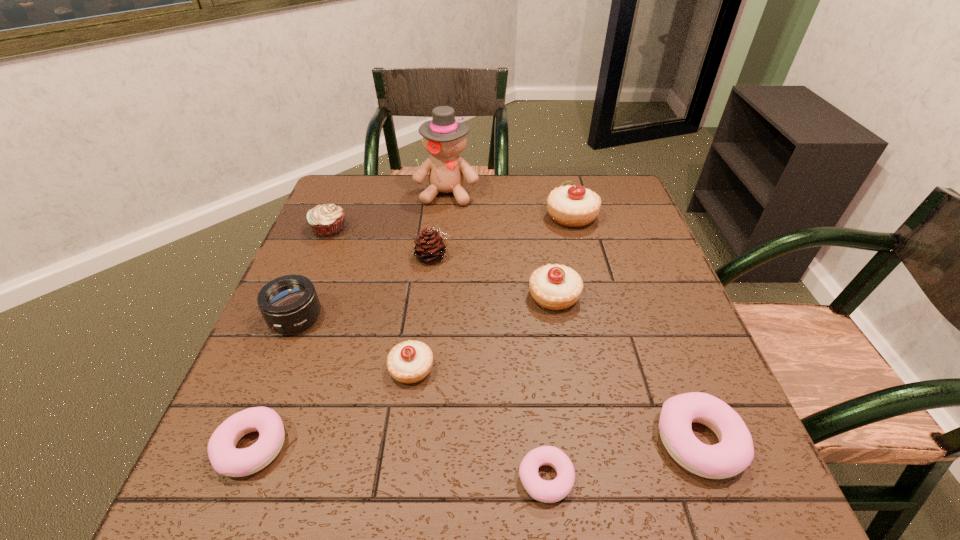
Locate an element on the screen. The image size is (960, 540). muffin that is at the left edge is located at coordinates (327, 220).

Where is `telephoto lens that is at the left edge`? Image resolution: width=960 pixels, height=540 pixels. telephoto lens that is at the left edge is located at coordinates click(x=288, y=304).

Image resolution: width=960 pixels, height=540 pixels. What are the coordinates of `pastry located in the left edge section of the desktop` in the screenshot? It's located at [x=226, y=459].

Locate an element on the screen. This screenshot has height=540, width=960. object positioned at the far left corner is located at coordinates (327, 220).

The width and height of the screenshot is (960, 540). What are the coordinates of `object located at the near left corner` in the screenshot? It's located at (226, 459).

Locate an element on the screen. The width and height of the screenshot is (960, 540). object present at the far right corner is located at coordinates (573, 206).

You are a GUI agent. You are given a task and a screenshot of the screen. Output one action in this format:
    pyautogui.click(x=<x>, y=<y>)
    Task: Click on the object positioned at the near right corner
    
    Given the screenshot: What is the action you would take?
    pyautogui.click(x=734, y=453)

This screenshot has width=960, height=540. I want to click on free region at the far edge, so click(437, 207).

Find the location of `free space at the near edge`. free space at the near edge is located at coordinates (308, 500).

Where is `vacant space at the left edge of the desktop`? vacant space at the left edge of the desktop is located at coordinates (261, 385).